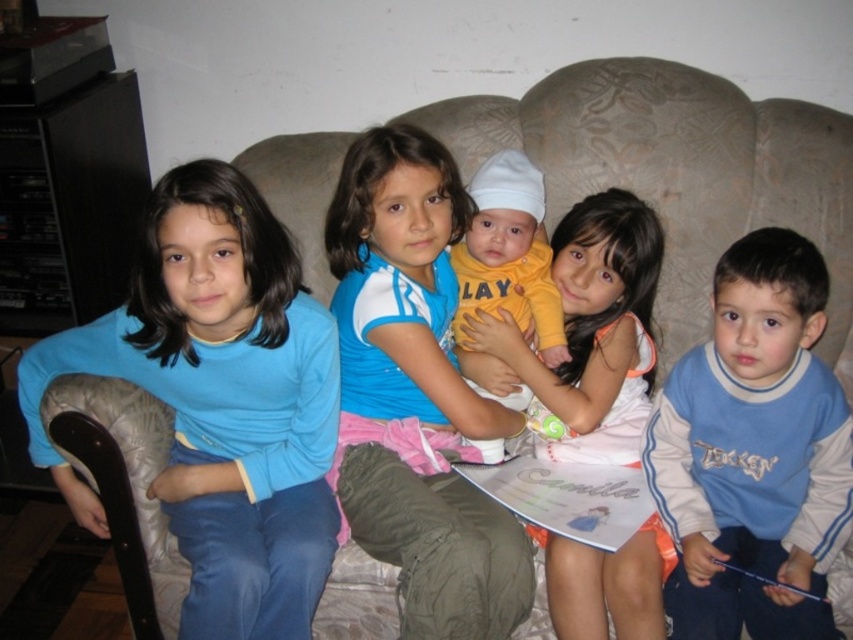
Question: Does blue cotton shirt at left have a smaller size compared to matte blue shirt at center?

Choices:
 (A) no
 (B) yes

Answer: (A)

Question: Estimate the real-world distances between objects in this image. Which object is closer to the white cotton dress at center?

Choices:
 (A) matte blue shirt at center
 (B) yellow cotton onesie at center

Answer: (B)

Question: Which of the following is the closest to the observer?

Choices:
 (A) (283, 520)
 (B) (521, 172)

Answer: (A)

Question: Considering the relative positions of blue cotton shirt at left and yellow cotton onesie at center in the image provided, where is blue cotton shirt at left located with respect to yellow cotton onesie at center?

Choices:
 (A) above
 (B) below

Answer: (B)

Question: Which of the following is the farthest from the observer?

Choices:
 (A) matte blue shirt at center
 (B) white cotton dress at center

Answer: (B)

Question: Can you confirm if blue cotton shirt at left is smaller than white cotton dress at center?

Choices:
 (A) no
 (B) yes

Answer: (A)